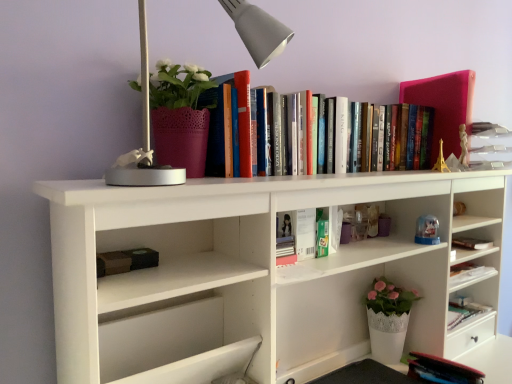
Question: Is green matte book at center, marked as the second book in a bottom-to-top arrangement, to the right of matte pink pot at upper left from the viewer's perspective?

Choices:
 (A) no
 (B) yes

Answer: (B)

Question: Is green matte book at center, marked as the second book in a bottom-to-top arrangement, looking in the opposite direction of matte pink pot at upper left?

Choices:
 (A) yes
 (B) no

Answer: (B)

Question: Are green matte book at center, which appears as the 2th book when viewed from the top, and matte pink pot at upper left located far from each other?

Choices:
 (A) no
 (B) yes

Answer: (A)

Question: Does green matte book at center, marked as the second book in a bottom-to-top arrangement, have a lesser width compared to matte pink pot at upper left?

Choices:
 (A) yes
 (B) no

Answer: (A)

Question: Does green matte book at center, marked as the second book in a bottom-to-top arrangement, lie in front of matte pink pot at upper left?

Choices:
 (A) yes
 (B) no

Answer: (B)

Question: Considering the positions of green matte book at center, which appears as the 2th book when viewed from the top, and metallic gray table lamp at upper left in the image, is green matte book at center, which appears as the 2th book when viewed from the top, bigger or smaller than metallic gray table lamp at upper left?

Choices:
 (A) big
 (B) small

Answer: (B)

Question: In terms of height, does green matte book at center, which appears as the 2th book when viewed from the top, look taller or shorter compared to metallic gray table lamp at upper left?

Choices:
 (A) short
 (B) tall

Answer: (A)

Question: From a real-world perspective, is green matte book at center, marked as the second book in a bottom-to-top arrangement, physically located above or below metallic gray table lamp at upper left?

Choices:
 (A) below
 (B) above

Answer: (A)

Question: Would you say green matte book at center, which appears as the 2th book when viewed from the top, is to the left or to the right of metallic gray table lamp at upper left in the picture?

Choices:
 (A) left
 (B) right

Answer: (B)

Question: From the image's perspective, relative to green matte book at center, which appears as the 2th book when viewed from the top, is hardcover books at upper center, acting as the 3th book starting from the bottom, above or below?

Choices:
 (A) below
 (B) above

Answer: (B)

Question: Is hardcover books at upper center, marked as the first book in a top-to-bottom arrangement, taller or shorter than green matte book at center, marked as the second book in a bottom-to-top arrangement?

Choices:
 (A) tall
 (B) short

Answer: (A)

Question: Considering their positions, is hardcover books at upper center, acting as the 3th book starting from the bottom, located in front of or behind green matte book at center, marked as the second book in a bottom-to-top arrangement?

Choices:
 (A) behind
 (B) front

Answer: (B)

Question: Choose the correct answer: Is hardcover books at upper center, acting as the 3th book starting from the bottom, inside green matte book at center, marked as the second book in a bottom-to-top arrangement, or outside it?

Choices:
 (A) inside
 (B) outside

Answer: (B)

Question: Looking at their shapes, would you say green matte book at center, which appears as the 2th book when viewed from the top, is wider or thinner than hardcover books at upper center, acting as the 3th book starting from the bottom?

Choices:
 (A) wide
 (B) thin

Answer: (B)

Question: In terms of size, does green matte book at center, marked as the second book in a bottom-to-top arrangement, appear bigger or smaller than hardcover books at upper center, marked as the first book in a top-to-bottom arrangement?

Choices:
 (A) big
 (B) small

Answer: (B)